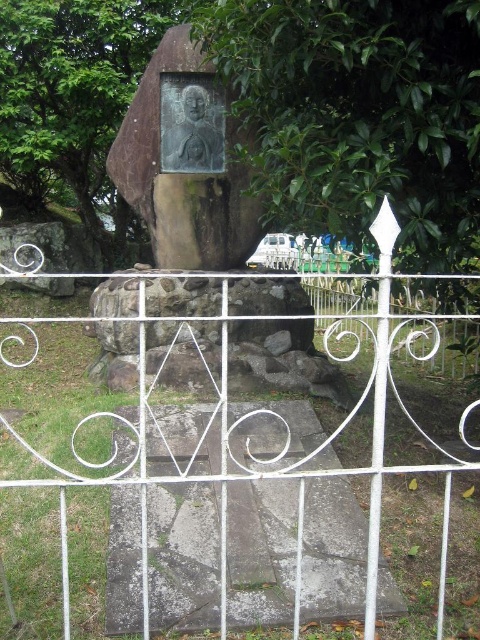
Who is more distant from viewer, (x=210, y=29) or (x=297, y=531)?

Point (x=210, y=29)

Locate an element on the screen. green leafy tree at upper center is located at coordinates (360, 115).

I want to click on green leafy tree at upper center, so 360,115.